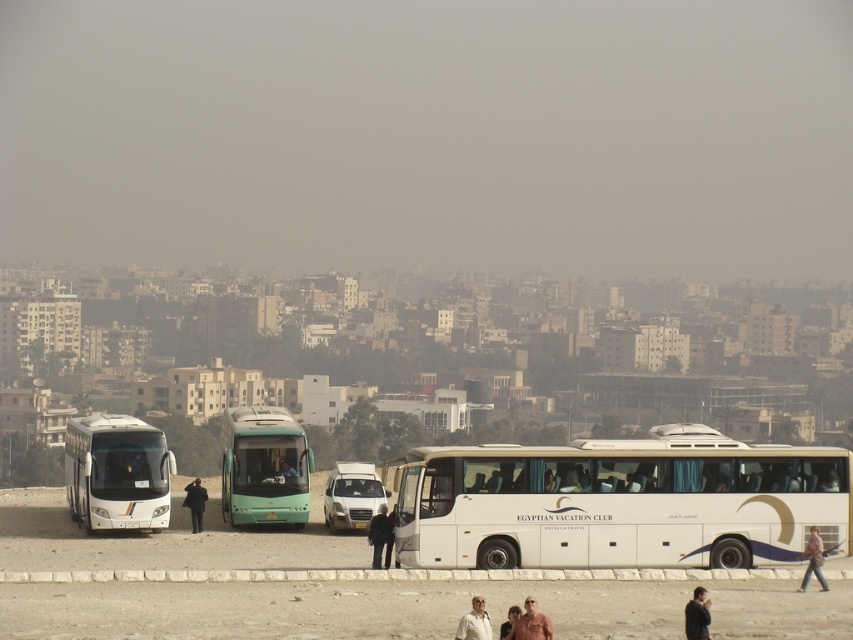
You are a tour guide standing at the center of the scene. You need to move your black fabric coat at center to the side so that you can access the white glossy bus at left. Is the space between the coat and the bus sufficient for you to move the coat without touching the bus?

The white glossy bus at left might be wider than black fabric coat at center, so there is a possibility that the space between them is not enough. You should check the actual distance before moving the coat to avoid touching the bus.

You are standing at the origin point of the coordinate system. You see the white glossy bus at left. Which direction should you move to reach it?

The white glossy bus at left is located at coordinates point (117, 474), so you should move towards the right and slightly downward from your current position to reach it.

You are a tour guide standing near the buses and want to ensure the white glossy bus at left and the black fabric person at lower right can both fit through a narrow tunnel entrance. The tunnel has a height restriction of 4 meters. Knowing the person is 1.8 meters tall, can both the bus and the person pass through without any issues?

The white glossy bus at left is much taller than the black fabric person at lower right. Since the tunnel has a 4 meter height restriction and the person is only 1.8 meters tall, the bus would likely exceed the height limit, making it impossible for both to pass through together.